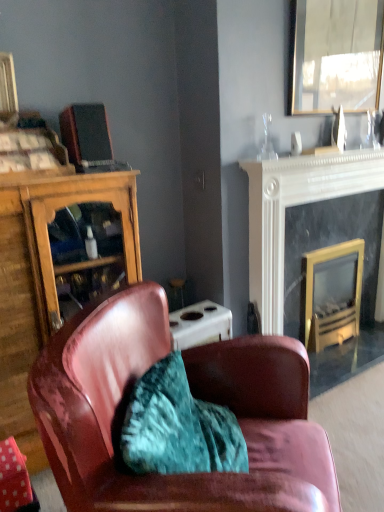
Question: Is leather armchair at center to the left of black marble fireplace at upper right, placed as the 2th fireplace when sorted from left to right, from the viewer's perspective?

Choices:
 (A) yes
 (B) no

Answer: (A)

Question: Is leather armchair at center oriented towards black marble fireplace at upper right, placed as the 2th fireplace when sorted from left to right?

Choices:
 (A) no
 (B) yes

Answer: (A)

Question: From the image's perspective, is leather armchair at center beneath black marble fireplace at upper right, placed as the 2th fireplace when sorted from left to right?

Choices:
 (A) yes
 (B) no

Answer: (A)

Question: Is leather armchair at center shorter than black marble fireplace at upper right, placed as the 2th fireplace when sorted from left to right?

Choices:
 (A) no
 (B) yes

Answer: (B)

Question: From a real-world perspective, is leather armchair at center below black marble fireplace at upper right, placed as the 2th fireplace when sorted from left to right?

Choices:
 (A) yes
 (B) no

Answer: (A)

Question: From their relative heights in the image, would you say matte black speaker at upper left is taller or shorter than wooden cabinet at left?

Choices:
 (A) tall
 (B) short

Answer: (B)

Question: In terms of size, does matte black speaker at upper left appear bigger or smaller than wooden cabinet at left?

Choices:
 (A) small
 (B) big

Answer: (A)

Question: Considering the relative positions of matte black speaker at upper left and wooden cabinet at left in the image provided, is matte black speaker at upper left to the left or to the right of wooden cabinet at left?

Choices:
 (A) right
 (B) left

Answer: (A)

Question: Is matte black speaker at upper left wider or thinner than wooden cabinet at left?

Choices:
 (A) thin
 (B) wide

Answer: (A)

Question: From a real-world perspective, is gold-framed glass fireplace at right, marked as the 1th fireplace in a left-to-right arrangement, positioned above or below matte black speaker at upper left?

Choices:
 (A) above
 (B) below

Answer: (B)

Question: Looking at their shapes, would you say gold-framed glass fireplace at right, which is the second fireplace from right to left, is wider or thinner than matte black speaker at upper left?

Choices:
 (A) thin
 (B) wide

Answer: (B)

Question: From the image's perspective, relative to matte black speaker at upper left, is gold-framed glass fireplace at right, which is the second fireplace from right to left, above or below?

Choices:
 (A) above
 (B) below

Answer: (B)

Question: In the image, is gold-framed glass fireplace at right, marked as the 1th fireplace in a left-to-right arrangement, positioned in front of or behind matte black speaker at upper left?

Choices:
 (A) behind
 (B) front

Answer: (A)

Question: Considering the positions of wooden cabinet at left and leather armchair at center in the image, is wooden cabinet at left taller or shorter than leather armchair at center?

Choices:
 (A) tall
 (B) short

Answer: (A)

Question: Considering the positions of point (36, 353) and point (74, 321), is point (36, 353) closer or farther from the camera than point (74, 321)?

Choices:
 (A) farther
 (B) closer

Answer: (A)